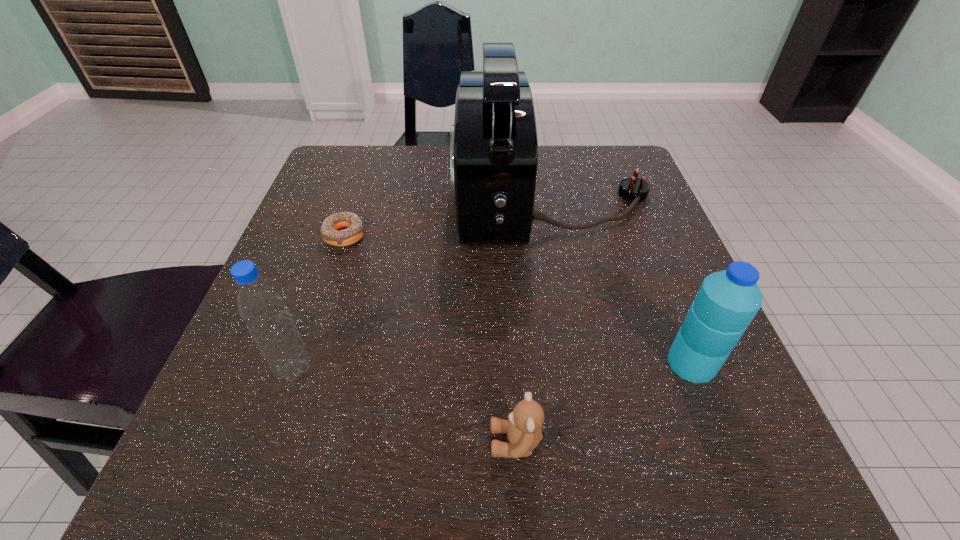
I want to click on the fourth closest object to the teddy bear, so click(x=355, y=230).